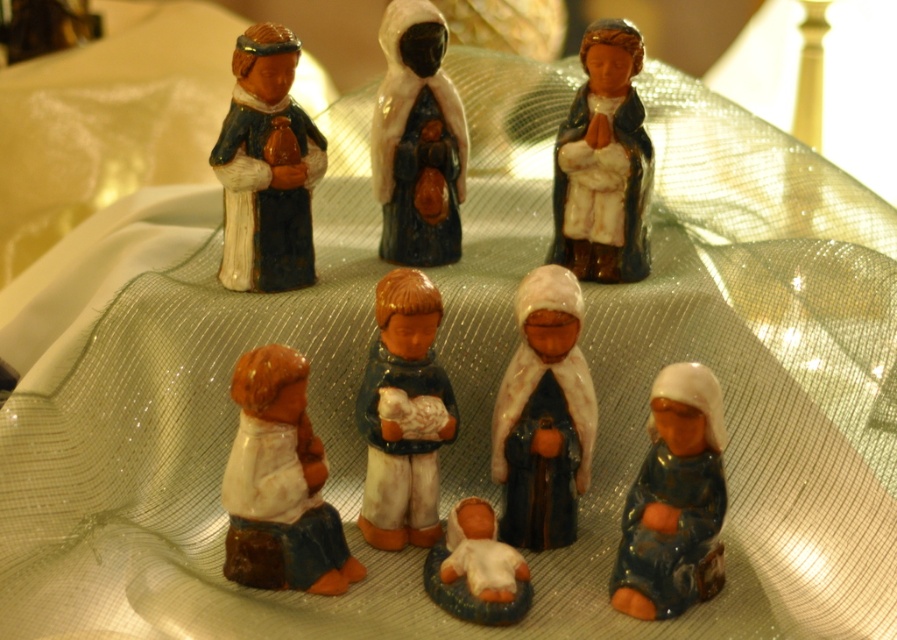
Question: Estimate the real-world distances between objects in this image. Which object is closer to the white glossy baby at center?

Choices:
 (A) matte ceramic figure at upper left
 (B) matte blue robe at center
 (C) brown matte figure at center-left
 (D) matte white porcelain figure at center

Answer: (D)

Question: From the image, what is the correct spatial relationship of matte ceramic figure at upper left in relation to matte blue figurine at upper right?

Choices:
 (A) left
 (B) right

Answer: (A)

Question: Estimate the real-world distances between objects in this image. Which object is closer to the matte brown figurine at center?

Choices:
 (A) brown matte figure at center-left
 (B) white glossy baby at center

Answer: (A)

Question: Does matte ceramic figure at upper left have a larger size compared to matte blue figurine at upper right?

Choices:
 (A) yes
 (B) no

Answer: (B)

Question: Which of the following is the farthest from the observer?

Choices:
 (A) (295, 486)
 (B) (498, 588)

Answer: (A)

Question: Considering the relative positions of matte blue porcelain baby at lower right and matte blue figurine at upper right in the image provided, where is matte blue porcelain baby at lower right located with respect to matte blue figurine at upper right?

Choices:
 (A) left
 (B) right

Answer: (B)